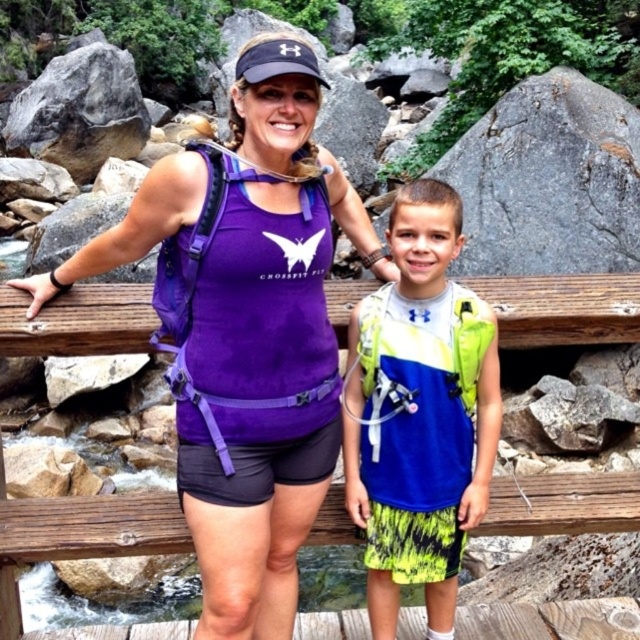
Is neon green mesh tank top at center positioned at the back of purple fabric bench at center?

That is True.

Looking at this image, who is taller, neon green mesh tank top at center or purple fabric bench at center?

With more height is neon green mesh tank top at center.

Which is in front, point (384, 464) or point (605, 275)?

Point (384, 464) is more forward.

This screenshot has height=640, width=640. Identify the location of neon green mesh tank top at center. [x=419, y=412].

Is point (422, 513) farther from viewer compared to point (593, 497)?

No, it is in front of (593, 497).

Who is shorter, neon green mesh tank top at center or wooden at center?

wooden at center

Who is more distant from viewer, (x=385, y=572) or (x=32, y=326)?

Point (x=385, y=572)

Where is `neon green mesh tank top at center`? This screenshot has width=640, height=640. neon green mesh tank top at center is located at coordinates (419, 412).

Does purple fabric tank top at center have a greater width compared to purple fabric bench at center?

Indeed, purple fabric tank top at center has a greater width compared to purple fabric bench at center.

Which is more to the left, purple fabric tank top at center or purple fabric bench at center?

Positioned to the left is purple fabric tank top at center.

This screenshot has width=640, height=640. In order to click on purple fabric tank top at center in this screenshot , I will do `click(266, 349)`.

This screenshot has width=640, height=640. Identify the location of purple fabric tank top at center. (266, 349).